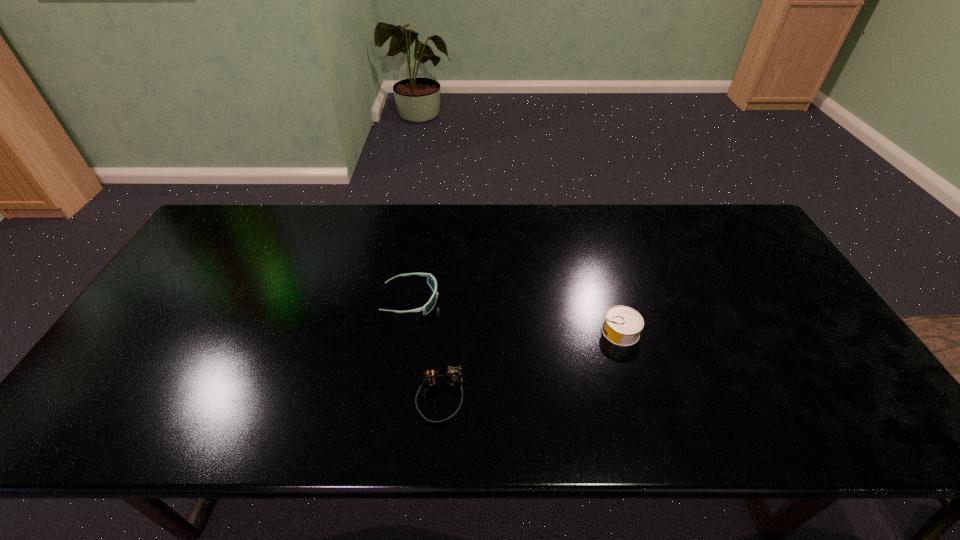
Where is `vacant area at the far left corner`? Image resolution: width=960 pixels, height=540 pixels. vacant area at the far left corner is located at coordinates (225, 216).

This screenshot has height=540, width=960. I want to click on free space between the nearer goggles and the farther goggles, so click(425, 349).

Where is `free point between the farther goggles and the rightmost object`? The height and width of the screenshot is (540, 960). free point between the farther goggles and the rightmost object is located at coordinates (516, 316).

Locate an element on the screen. The height and width of the screenshot is (540, 960). vacant space in between the farther goggles and the nearest object is located at coordinates (425, 349).

Identify the location of free spot between the rightmost object and the farther goggles. (516, 316).

In order to click on vacant space that's between the can and the farther goggles in this screenshot , I will do `click(516, 316)`.

What are the coordinates of `vacant space that's between the can and the nearer goggles` in the screenshot? It's located at (530, 366).

The width and height of the screenshot is (960, 540). What are the coordinates of `empty space that is in between the farther goggles and the nearer goggles` in the screenshot? It's located at (425, 349).

Locate an element on the screen. The width and height of the screenshot is (960, 540). free area in between the farther goggles and the nearest object is located at coordinates (425, 349).

This screenshot has height=540, width=960. Identify the location of free space between the rightmost object and the farther goggles. tap(516, 316).